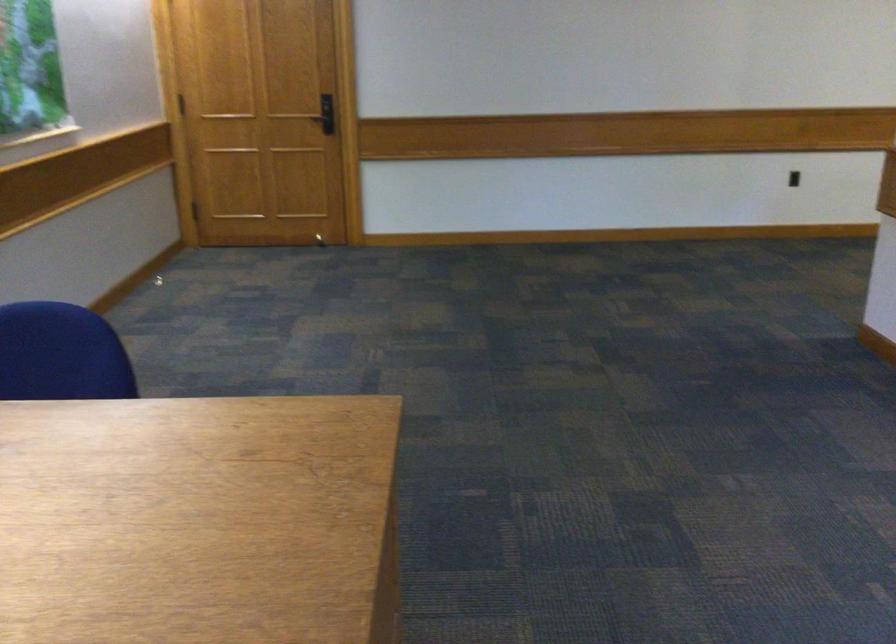
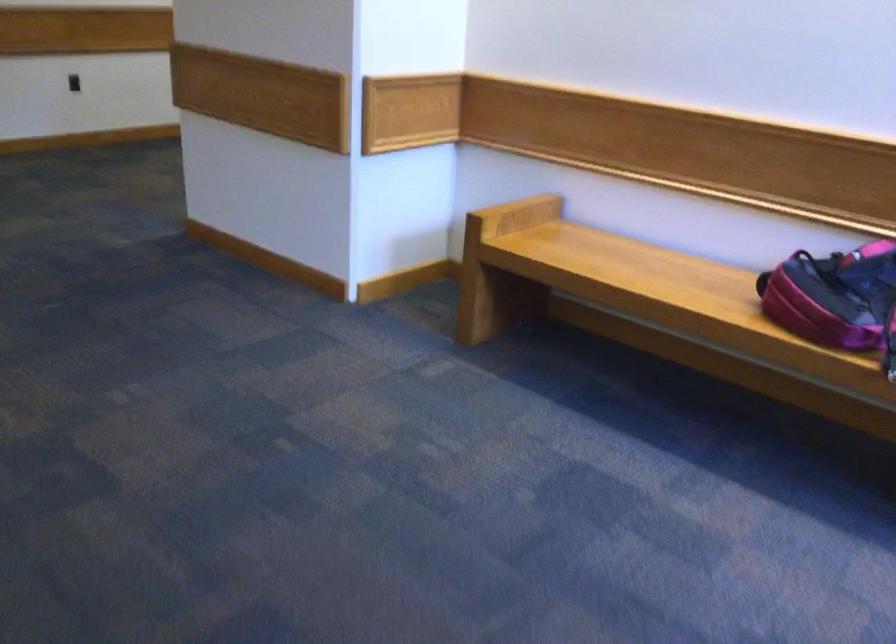
Question: The camera is either moving clockwise (left) or counter-clockwise (right) around the object. The first image is from the beginning of the video and the second image is from the end. Is the camera moving left or right when shooting the video?

Choices:
 (A) Left
 (B) Right

Answer: (A)